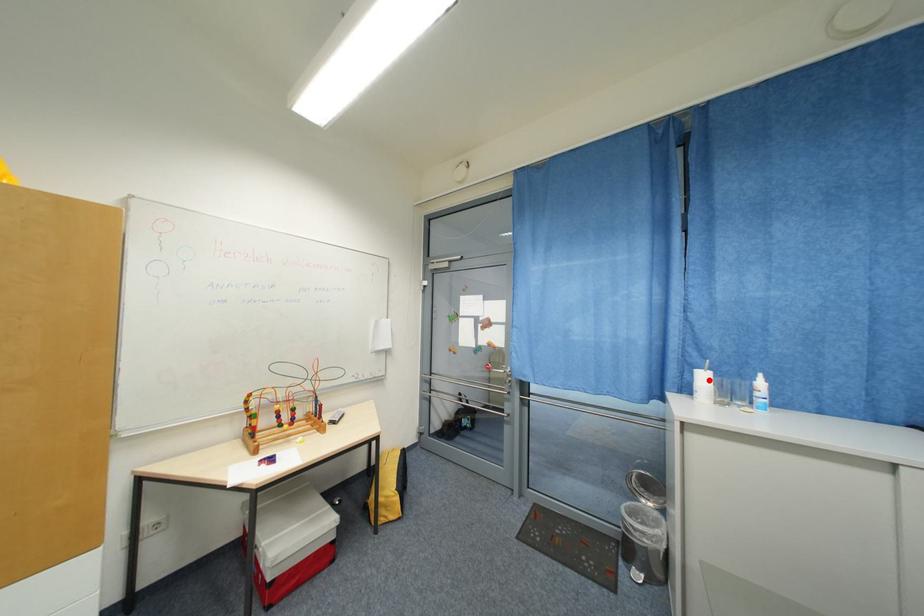
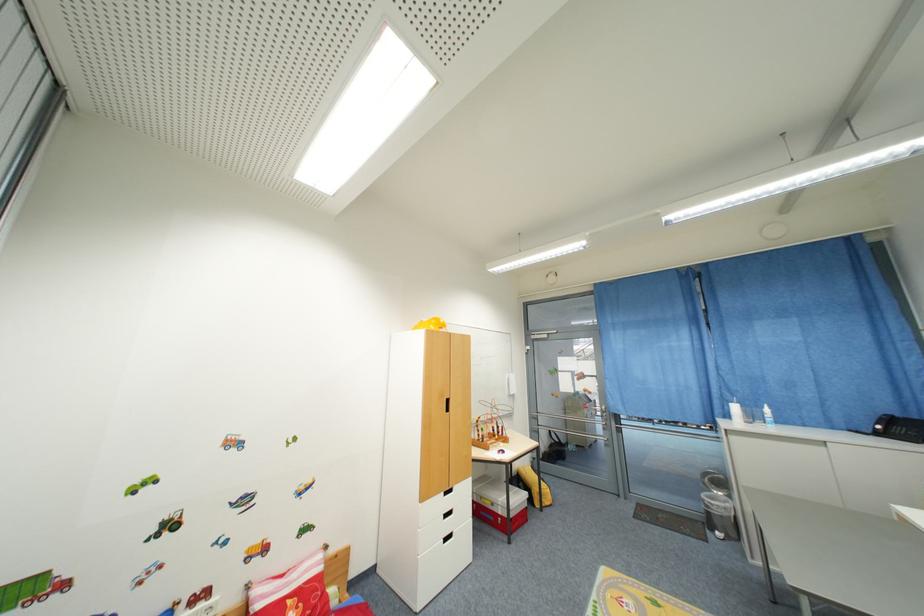
In the second image, find the point that corresponds to the highlighted location in the first image.

(740, 410)